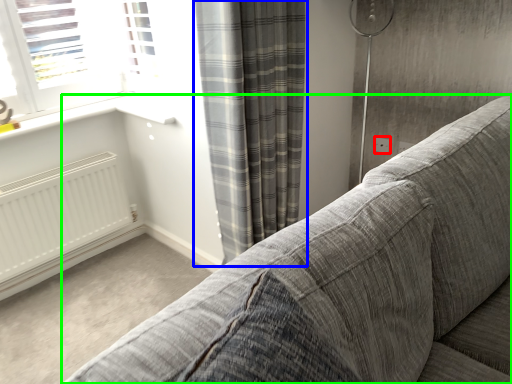
Question: Which object is positioned closest to electric outlet (highlighted by a red box)? Select from curtain (highlighted by a blue box) and studio couch (highlighted by a green box).

Choices:
 (A) curtain
 (B) studio couch

Answer: (A)